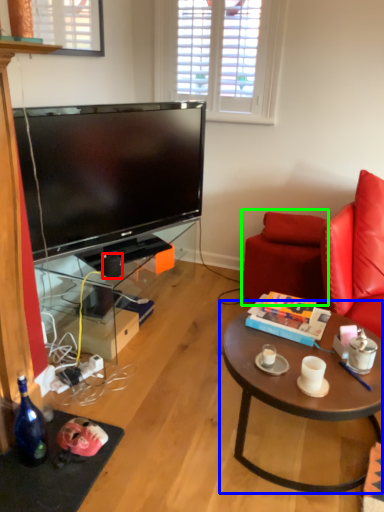
Question: Which object is positioned farthest from speaker (highlighted by a red box)? Select from coffee table (highlighted by a blue box) and swivel chair (highlighted by a green box).

Choices:
 (A) coffee table
 (B) swivel chair

Answer: (A)